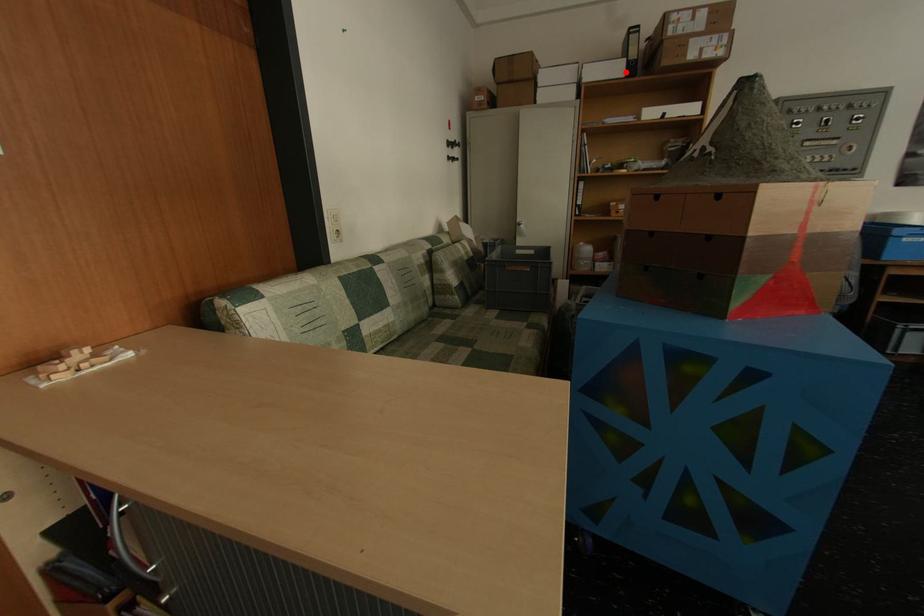
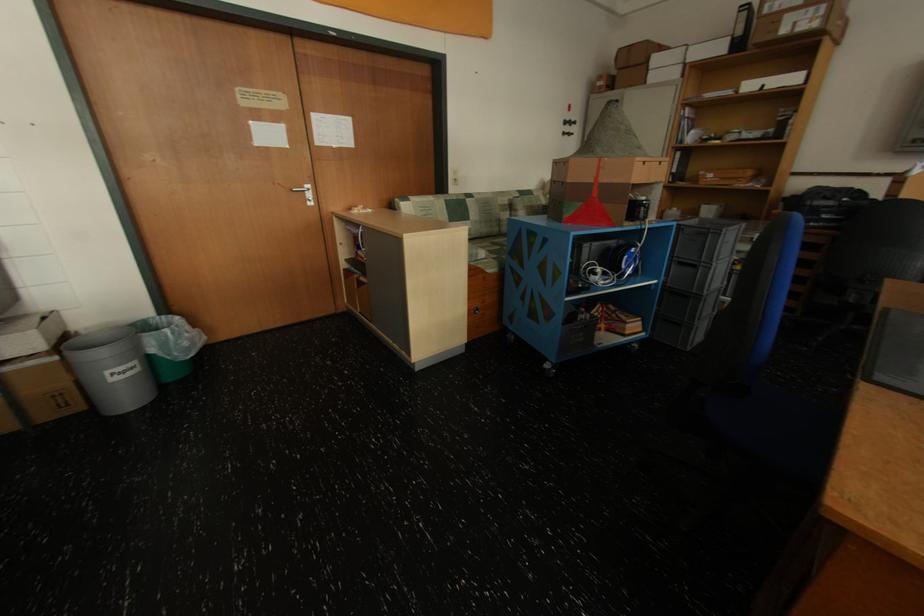
Find the pixel in the second image that matches the highlighted location in the first image.

(728, 50)